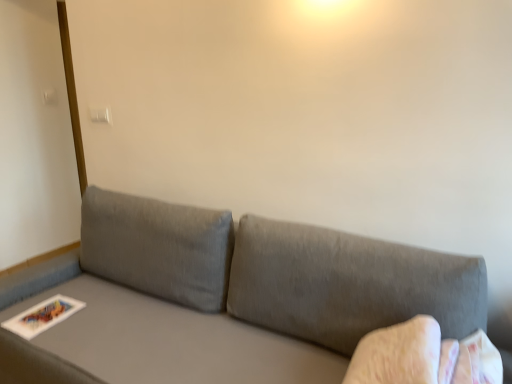
In order to click on white glossy magazine at lower left in this screenshot , I will do pos(42,316).

Describe the element at coordinates (42, 316) in the screenshot. I see `white glossy magazine at lower left` at that location.

Identify the location of white glossy magazine at lower left. (x=42, y=316).